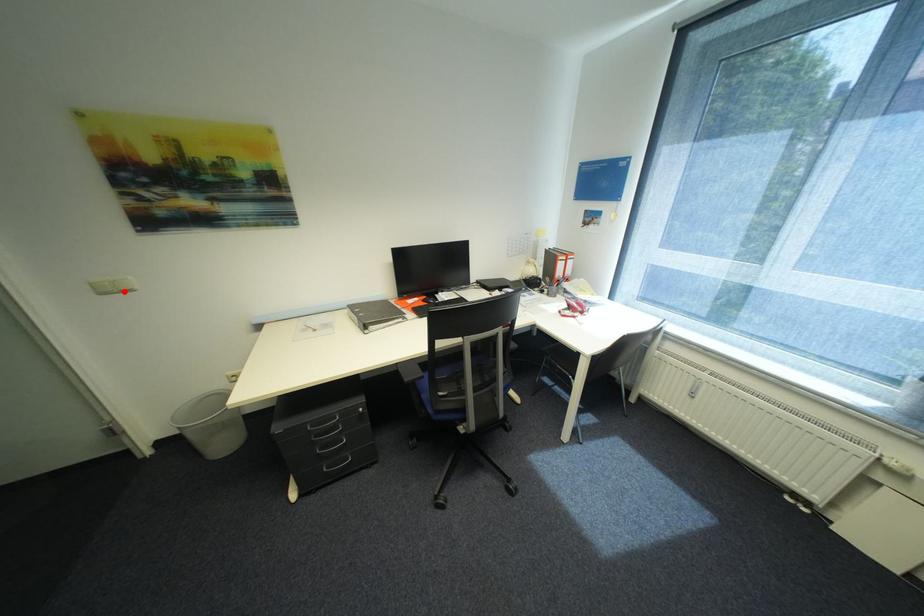
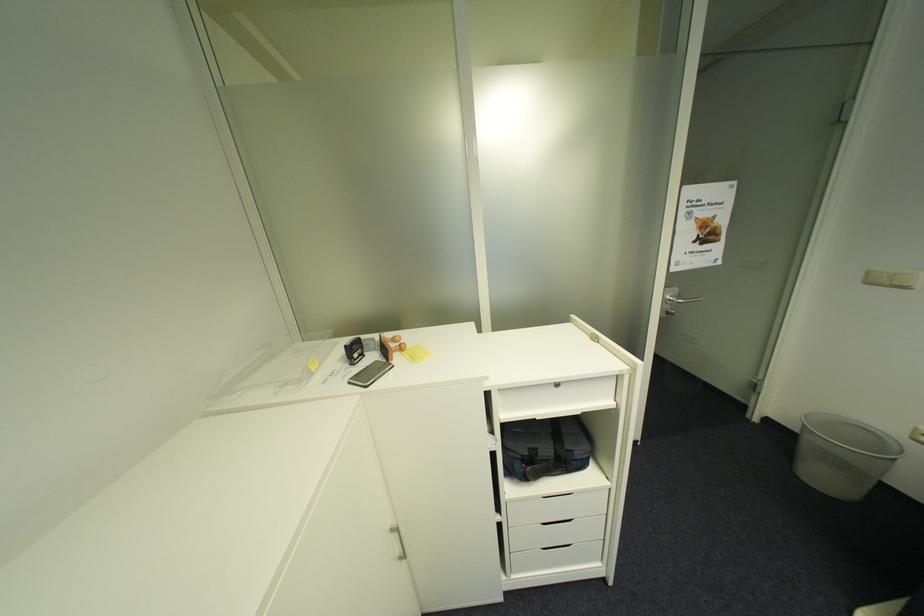
Find the pixel in the second image that matches the highlighted location in the first image.

(895, 285)